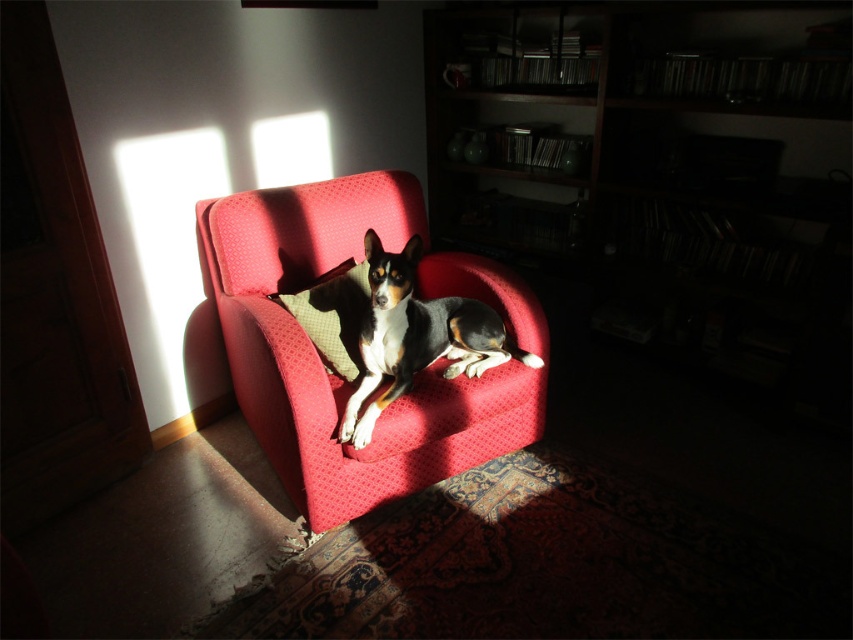
Question: Which object appears farthest from the camera in this image?

Choices:
 (A) green textured pillow at center
 (B) velvet red armchair at center

Answer: (A)

Question: Is the position of black and white fur dog at center less distant than that of green textured pillow at center?

Choices:
 (A) yes
 (B) no

Answer: (A)

Question: Does velvet red armchair at center appear over black and white fur dog at center?

Choices:
 (A) yes
 (B) no

Answer: (B)

Question: Which point is closer to the camera?

Choices:
 (A) (395, 224)
 (B) (357, 445)

Answer: (B)

Question: Does velvet red armchair at center appear over black and white fur dog at center?

Choices:
 (A) yes
 (B) no

Answer: (B)

Question: Which is farther from the green textured pillow at center?

Choices:
 (A) velvet red armchair at center
 (B) black and white fur dog at center

Answer: (A)